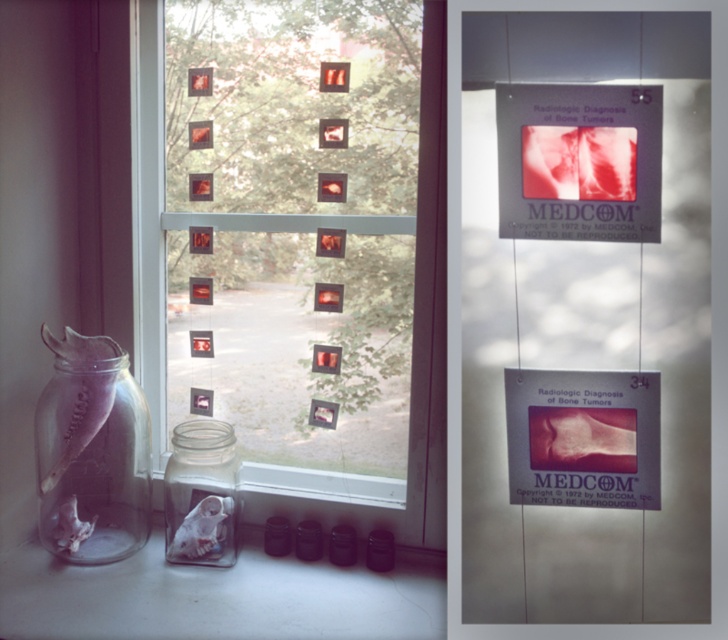
You are a visitor trying to read the text on the matte plastic poster at upper right. Can you see it clearly through the transparent glass window at center?

The matte plastic poster at upper right is in front of the transparent glass window at center, so it blocks the view of the window. Therefore, you can see the text on the matte plastic poster at upper right clearly without interference from the window.

You are an interior designer planning to add a new decorative element between the matte plastic poster at upper right and the transparent glass window at center. Based on their positions, which object should be closer to the left side when placing the new item?

The transparent glass window at center is to the left of the matte plastic poster at upper right, so the new decorative element should be placed closer to the transparent glass window at center to maintain the left side positioning.

You are an interior designer arranging a medical office. You have two matte posters to place on a wall. The matte plastic poster at upper right and the matte paper poster at center. Which poster is wider?

The matte plastic poster at upper right is wider than the matte paper poster at center because its width surpasses the other.